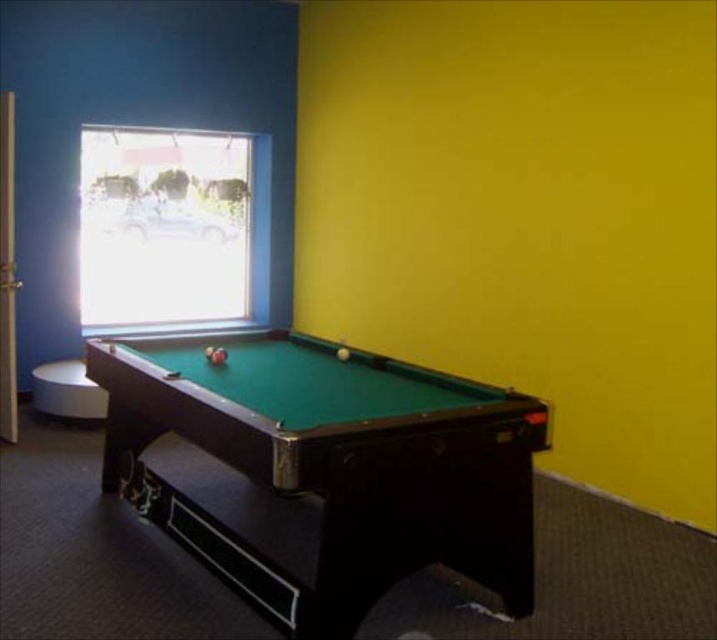
You are standing in the room and want to place a large painting on the wall behind the green felt pool table at center. Which wall should you choose, the one adjacent to the transparent glass window at upper left or the one opposite to it?

The green felt pool table at center is positioned on the right side of transparent glass window at upper left. Therefore, the wall behind the green felt pool table at center is the one adjacent to the transparent glass window at upper left, so you should choose that wall.

You are standing in the room and want to throw a ball from the pool table to the transparent glass window at upper left. The ball you want to throw has a diameter of 0.07 meters. Considering the distance, will the ball travel more than 5 meters before reaching the window?

The transparent glass window at upper left is 5.37 meters away from camera. The ball has a diameter of 0.07 meters, so the distance is slightly over 5 meters. Therefore, the ball will travel more than 5 meters before reaching the window.